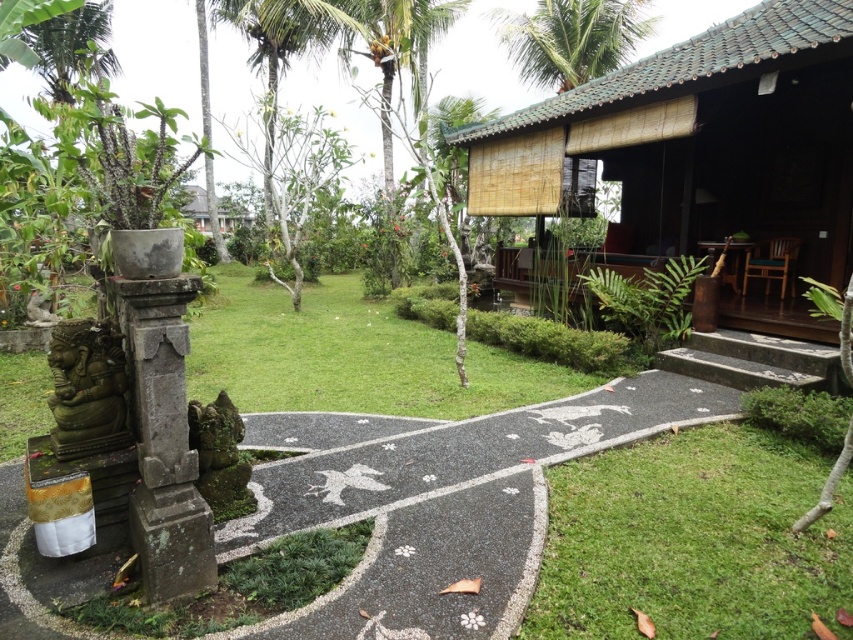
Which of these two, matte bamboo hut at center or green grass at lower right, stands shorter?

matte bamboo hut at center

Is matte bamboo hut at center taller than green grass at lower right?

No, matte bamboo hut at center is not taller than green grass at lower right.

Is point (715, 140) closer to camera compared to point (815, 490)?

No, (715, 140) is behind (815, 490).

At what (x,y) coordinates should I click in order to perform the action: click on matte bamboo hut at center. Please return your answer as a coordinate pair (x, y). The image size is (853, 640). Looking at the image, I should click on coord(699,138).

Which is behind, point (618, 88) or point (582, 36)?

Point (582, 36)

Can you confirm if matte bamboo hut at center is shorter than green leafy palm tree at upper center?

Indeed, matte bamboo hut at center has a lesser height compared to green leafy palm tree at upper center.

Identify the location of matte bamboo hut at center. (699, 138).

This screenshot has width=853, height=640. In order to click on matte bamboo hut at center in this screenshot , I will do `click(699, 138)`.

Is the position of green grass at lower right more distant than that of green leafy palm tree at upper center?

No.

Which of these two, green grass at lower right or green leafy palm tree at upper center, stands taller?

green leafy palm tree at upper center

Is point (643, 573) farther from viewer compared to point (619, 42)?

That is False.

This screenshot has width=853, height=640. I want to click on green grass at lower right, so click(692, 540).